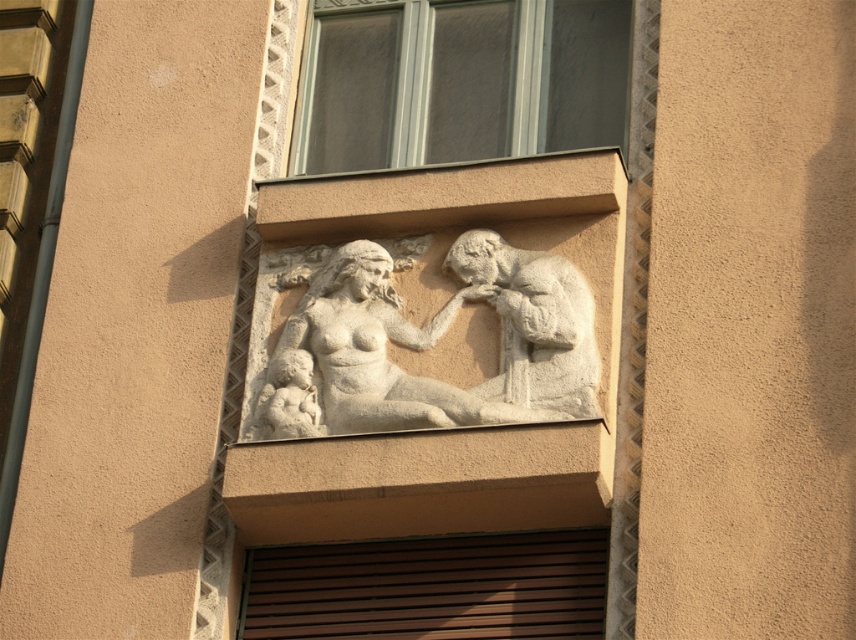
Question: Which object appears farthest from the camera in this image?

Choices:
 (A) clear glass window at upper center
 (B) white stone relief at center

Answer: (A)

Question: Which point is closer to the camera taking this photo?

Choices:
 (A) (516, 388)
 (B) (377, 29)
 (C) (456, 252)

Answer: (A)

Question: Considering the relative positions of clear glass window at upper center and white stone sculpture at center in the image provided, where is clear glass window at upper center located with respect to white stone sculpture at center?

Choices:
 (A) right
 (B) left

Answer: (B)

Question: Can you confirm if clear glass window at upper center is positioned to the right of white stone relief at center?

Choices:
 (A) yes
 (B) no

Answer: (A)

Question: Observing the image, what is the correct spatial positioning of clear glass window at upper center in reference to white stone relief at center?

Choices:
 (A) right
 (B) left

Answer: (A)

Question: Which point is farther to the camera?

Choices:
 (A) (527, 305)
 (B) (311, 131)

Answer: (B)